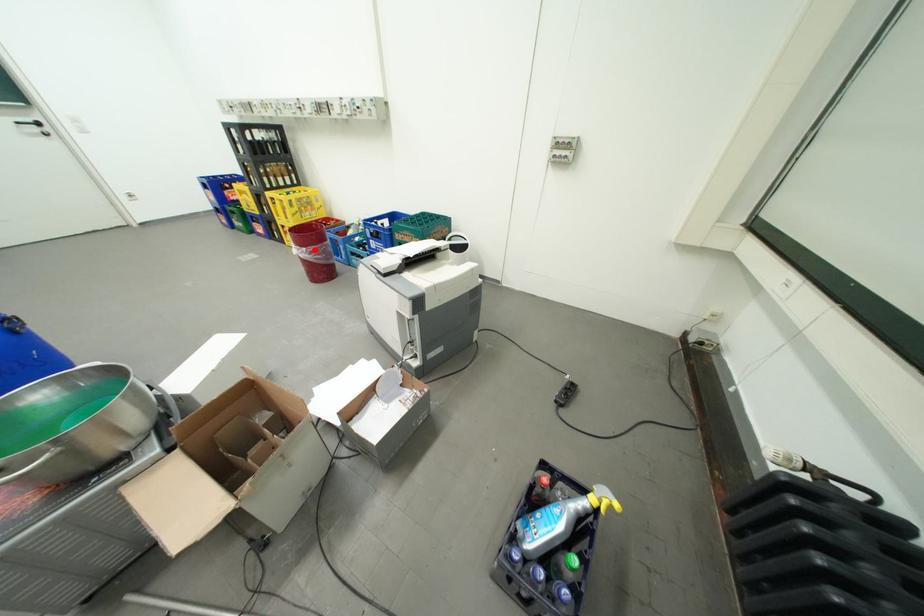
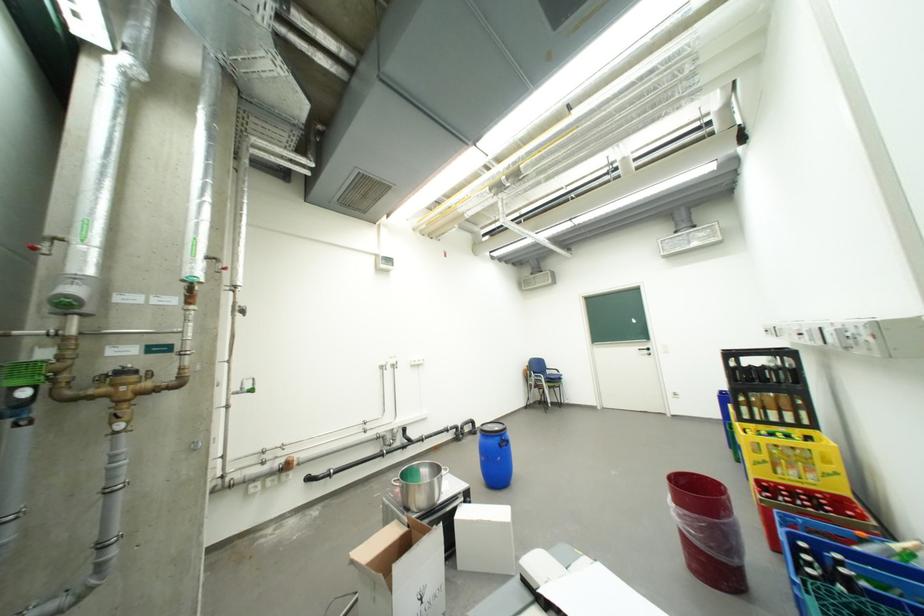
Question: I am providing you with two images of the same scene from different viewpoints. A red point is shown in image1. For the corresponding object point in image2, is it positioned nearer or farther from the camera?

Choices:
 (A) Nearer
 (B) Farther

Answer: (B)